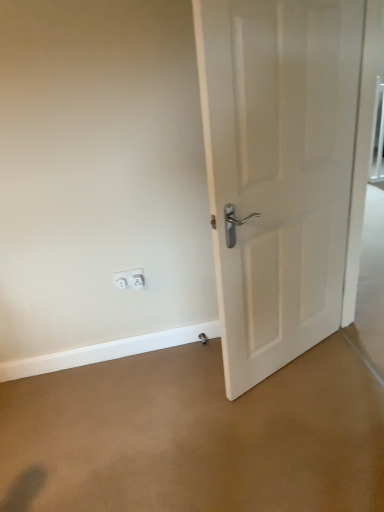
The image size is (384, 512). In order to click on brown carpet at center in this screenshot , I will do `click(195, 436)`.

This screenshot has height=512, width=384. Describe the element at coordinates (195, 436) in the screenshot. I see `brown carpet at center` at that location.

What do you see at coordinates (138, 281) in the screenshot?
I see `white plastic electric outlet at lower left, placed as the 2th electric outlet when sorted from left to right` at bounding box center [138, 281].

In order to face white plastic electric outlet at lower left, the 2th electric outlet viewed from the right, should I rotate leftwards or rightwards?

To face it directly, rotate left by 8.208 degrees.

Where is `white matte door at right`? The width and height of the screenshot is (384, 512). white matte door at right is located at coordinates (278, 170).

What's the angular difference between white matte door at right and white plastic electric outlet at lower left, the 2th electric outlet viewed from the right,'s facing directions?

The facing directions of white matte door at right and white plastic electric outlet at lower left, the 2th electric outlet viewed from the right, are 22.6 degrees apart.

Does white matte door at right appear on the left side of white plastic electric outlet at lower left, the 2th electric outlet viewed from the right?

No, white matte door at right is not to the left of white plastic electric outlet at lower left, the 2th electric outlet viewed from the right.

Can you see white matte door at right touching white plastic electric outlet at lower left, the 2th electric outlet viewed from the right?

There is a gap between white matte door at right and white plastic electric outlet at lower left, the 2th electric outlet viewed from the right.

Looking at this image, does white matte door at right have a larger size compared to white plastic electric outlet at lower left, the 2th electric outlet viewed from the right?

Indeed, white matte door at right has a larger size compared to white plastic electric outlet at lower left, the 2th electric outlet viewed from the right.

Does white matte door at right have a larger size compared to white plastic electric outlet at lower left, placed as the 2th electric outlet when sorted from left to right?

Indeed, white matte door at right has a larger size compared to white plastic electric outlet at lower left, placed as the 2th electric outlet when sorted from left to right.

From the image's perspective, is white matte door at right on top of white plastic electric outlet at lower left, placed as the 2th electric outlet when sorted from left to right?

Yes.

Consider the image. Could you tell me if white matte door at right is facing white plastic electric outlet at lower left, the 1th electric outlet from the right?

No, white matte door at right is not aimed at white plastic electric outlet at lower left, the 1th electric outlet from the right.

Looking at this image, is white matte door at right to the left of white plastic electric outlet at lower left, the 1th electric outlet from the right, from the viewer's perspective?

No.

Is white plastic electric outlet at lower left, the 2th electric outlet viewed from the right, located outside white matte door at right?

Absolutely, white plastic electric outlet at lower left, the 2th electric outlet viewed from the right, is external to white matte door at right.

Is white plastic electric outlet at lower left, the 2th electric outlet viewed from the right, not close to white matte door at right?

They are positioned close to each other.

You are a GUI agent. You are given a task and a screenshot of the screen. Output one action in this format:
    pyautogui.click(x=<x>, y=<y>)
    Task: Click on the door above the white plastic electric outlet at lower left, arranged as the 1th electric outlet when viewed from the left (from a real-world perspective)
    
    Given the screenshot: What is the action you would take?
    pyautogui.click(x=278, y=170)

Looking at this image, how many degrees apart are the facing directions of white plastic electric outlet at lower left, the 2th electric outlet viewed from the right, and white matte door at right?

The facing directions of white plastic electric outlet at lower left, the 2th electric outlet viewed from the right, and white matte door at right are 22.6 degrees apart.

Relative to brown carpet at center, is white matte door at right in front or behind?

white matte door at right is in front of brown carpet at center.

Is white matte door at right looking in the opposite direction of brown carpet at center?

No, white matte door at right is not facing away from brown carpet at center.

Considering the sizes of objects white matte door at right and brown carpet at center in the image provided, who is thinner, white matte door at right or brown carpet at center?

white matte door at right.

Are white matte door at right and brown carpet at center located far from each other?

No, there isn't a large distance between white matte door at right and brown carpet at center.

How different are the orientations of brown carpet at center and white matte door at right in degrees?

The angle between the facing direction of brown carpet at center and the facing direction of white matte door at right is 67 degrees.

Is brown carpet at center facing towards white matte door at right?

No.

Can you confirm if brown carpet at center is smaller than white matte door at right?

Yes.

Looking at this image, is white matte door at right inside brown carpet at center?

No, brown carpet at center does not contain white matte door at right.

In terms of height, does white plastic electric outlet at lower left, the 1th electric outlet from the right, look taller or shorter compared to brown carpet at center?

white plastic electric outlet at lower left, the 1th electric outlet from the right, is taller than brown carpet at center.

Based on the photo, considering the sizes of objects white plastic electric outlet at lower left, placed as the 2th electric outlet when sorted from left to right, and brown carpet at center in the image provided, who is thinner, white plastic electric outlet at lower left, placed as the 2th electric outlet when sorted from left to right, or brown carpet at center?

white plastic electric outlet at lower left, placed as the 2th electric outlet when sorted from left to right.

Based on the photo, are white plastic electric outlet at lower left, the 1th electric outlet from the right, and brown carpet at center making contact?

No.

Could you tell me if white plastic electric outlet at lower left, the 1th electric outlet from the right, is turned towards brown carpet at center?

No, white plastic electric outlet at lower left, the 1th electric outlet from the right, is not facing towards brown carpet at center.

Can white plastic electric outlet at lower left, the 2th electric outlet viewed from the right, be found inside white plastic electric outlet at lower left, placed as the 2th electric outlet when sorted from left to right?

No.

In the scene shown: Can you confirm if white plastic electric outlet at lower left, placed as the 2th electric outlet when sorted from left to right, is shorter than white plastic electric outlet at lower left, the 2th electric outlet viewed from the right?

Indeed, white plastic electric outlet at lower left, placed as the 2th electric outlet when sorted from left to right, has a lesser height compared to white plastic electric outlet at lower left, the 2th electric outlet viewed from the right.

What are the coordinates of `electric outlet that appears below the white plastic electric outlet at lower left, arranged as the 1th electric outlet when viewed from the left (from the image's perspective)` in the screenshot? It's located at 138,281.

How different are the orientations of white plastic electric outlet at lower left, placed as the 2th electric outlet when sorted from left to right, and white plastic electric outlet at lower left, the 2th electric outlet viewed from the right, in degrees?

There is a 0.00634-degree angle between the facing directions of white plastic electric outlet at lower left, placed as the 2th electric outlet when sorted from left to right, and white plastic electric outlet at lower left, the 2th electric outlet viewed from the right.

Locate an element on the screen. door above the white plastic electric outlet at lower left, the 2th electric outlet viewed from the right (from a real-world perspective) is located at coordinates (278, 170).

This screenshot has height=512, width=384. In the image, there is a white plastic electric outlet at lower left, placed as the 2th electric outlet when sorted from left to right. Identify the location of door above it (from the image's perspective). (278, 170).

Based on their spatial positions, is brown carpet at center or white plastic electric outlet at lower left, arranged as the 1th electric outlet when viewed from the left, closer to white matte door at right?

brown carpet at center is positioned closer to the anchor white matte door at right.

Which object lies further to the anchor point brown carpet at center, white plastic electric outlet at lower left, placed as the 2th electric outlet when sorted from left to right, or white matte door at right?

white plastic electric outlet at lower left, placed as the 2th electric outlet when sorted from left to right, is further to brown carpet at center.

Which object lies further to the anchor point white plastic electric outlet at lower left, the 2th electric outlet viewed from the right, white matte door at right or white plastic electric outlet at lower left, placed as the 2th electric outlet when sorted from left to right?

Among the two, white matte door at right is located further to white plastic electric outlet at lower left, the 2th electric outlet viewed from the right.

Estimate the real-world distances between objects in this image. Which object is closer to white plastic electric outlet at lower left, the 2th electric outlet viewed from the right, white matte door at right or brown carpet at center?

The object closer to white plastic electric outlet at lower left, the 2th electric outlet viewed from the right, is brown carpet at center.

Looking at this image, when comparing their distances from white plastic electric outlet at lower left, the 2th electric outlet viewed from the right, does white plastic electric outlet at lower left, the 1th electric outlet from the right, or white matte door at right seem further?

white matte door at right is positioned further to the anchor white plastic electric outlet at lower left, the 2th electric outlet viewed from the right.

From the image, which object appears to be nearer to brown carpet at center, white plastic electric outlet at lower left, the 1th electric outlet from the right, or white plastic electric outlet at lower left, arranged as the 1th electric outlet when viewed from the left?

white plastic electric outlet at lower left, arranged as the 1th electric outlet when viewed from the left, is closer to brown carpet at center.

From the image, which object appears to be farther from white matte door at right, brown carpet at center or white plastic electric outlet at lower left, placed as the 2th electric outlet when sorted from left to right?

white plastic electric outlet at lower left, placed as the 2th electric outlet when sorted from left to right, lies further to white matte door at right than the other object.

Based on the photo, considering their positions, is white matte door at right positioned further to brown carpet at center than white plastic electric outlet at lower left, arranged as the 1th electric outlet when viewed from the left?

white plastic electric outlet at lower left, arranged as the 1th electric outlet when viewed from the left.

Where is `electric outlet between brown carpet at center and white plastic electric outlet at lower left, the 2th electric outlet viewed from the right, from front to back`? This screenshot has height=512, width=384. electric outlet between brown carpet at center and white plastic electric outlet at lower left, the 2th electric outlet viewed from the right, from front to back is located at coordinates (138, 281).

At what (x,y) coordinates should I click in order to perform the action: click on concrete between white matte door at right and white plastic electric outlet at lower left, the 1th electric outlet from the right, along the z-axis. Please return your answer as a coordinate pair (x, y). The height and width of the screenshot is (512, 384). Looking at the image, I should click on (195, 436).

What are the coordinates of `electric outlet between white matte door at right and white plastic electric outlet at lower left, the 2th electric outlet viewed from the right, along the z-axis` in the screenshot? It's located at (138, 281).

Image resolution: width=384 pixels, height=512 pixels. I want to click on concrete between white matte door at right and white plastic electric outlet at lower left, the 2th electric outlet viewed from the right, along the z-axis, so [x=195, y=436].